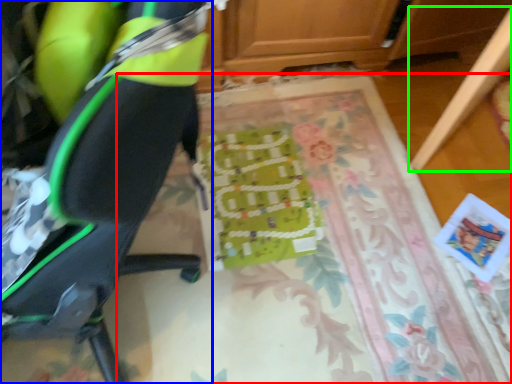
Question: Which object is the closest to the mat (highlighted by a red box)? Choose among these: chair (highlighted by a blue box) or furniture (highlighted by a green box).

Choices:
 (A) chair
 (B) furniture

Answer: (B)